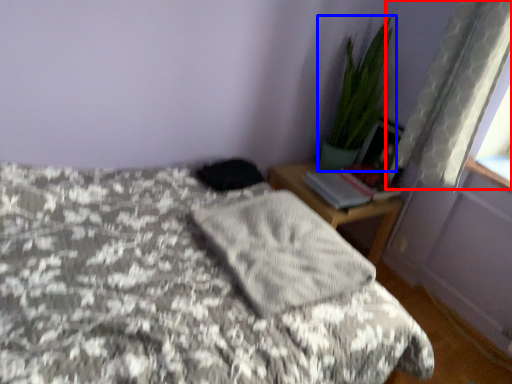
Question: Which of the following is the farthest to the observer, curtain (highlighted by a red box) or houseplant (highlighted by a blue box)?

Choices:
 (A) curtain
 (B) houseplant

Answer: (B)